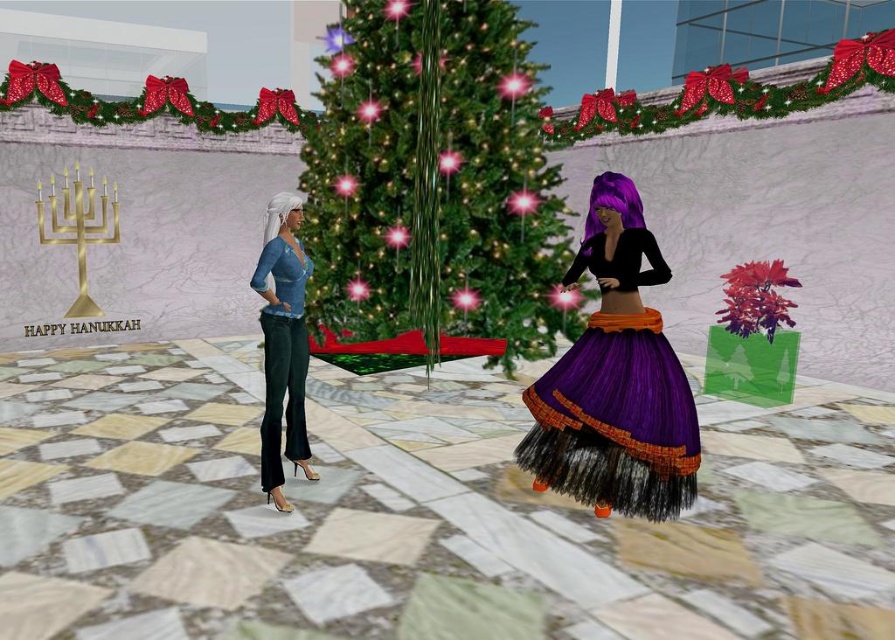
You are a photographer planning to take a photo of the two characters in front of the green shiny christmas tree at center and the velvet teal pants at left. From the photographer perspective, which object is positioned to the right side of the scene?

The green shiny christmas tree at center is positioned to the right of the velvet teal pants at left, so it is on the right side of the scene.

You are a fashion designer observing a festive scene with two characters. You need to determine which clothing item is bigger between the purple tulle skirt at center and the velvet teal pants at left. Which one should you choose if you want to create a design that emphasizes volume?

The purple tulle skirt at center has a larger size compared to velvet teal pants at left, so you should choose the purple tulle skirt at center to emphasize volume.